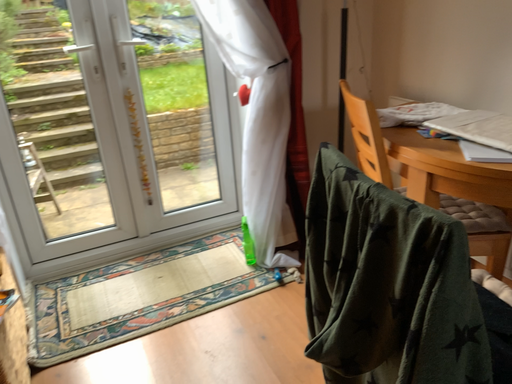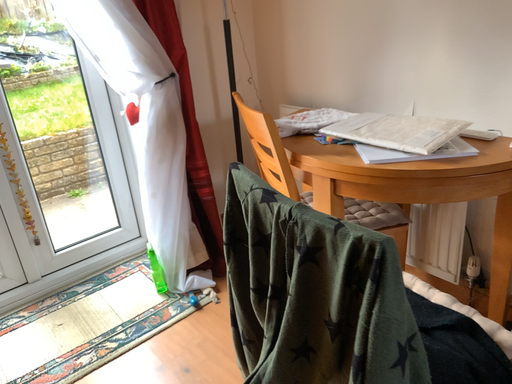
Question: How did the camera likely rotate when shooting the video?

Choices:
 (A) rotated right
 (B) rotated left

Answer: (A)